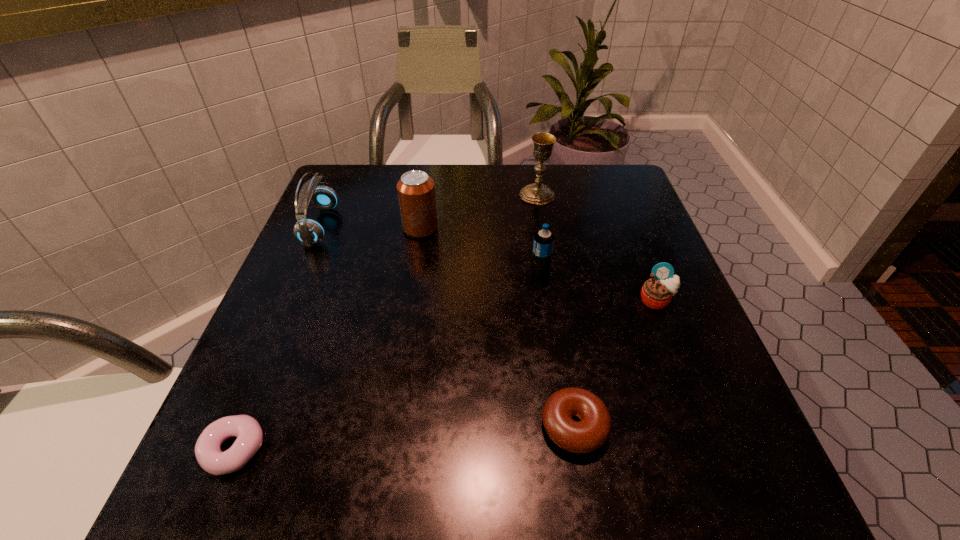
The image size is (960, 540). Find the location of `blank region between the left doughnut and the headset`. blank region between the left doughnut and the headset is located at coordinates (277, 338).

I want to click on vacant space that is in between the soda bottle and the can, so click(x=480, y=250).

Where is `free space between the rightmost object and the headset`? Image resolution: width=960 pixels, height=540 pixels. free space between the rightmost object and the headset is located at coordinates (489, 264).

Find the location of a particular element. Image resolution: width=960 pixels, height=540 pixels. vacant space in between the chalice and the shorter doughnut is located at coordinates (386, 322).

Locate an element on the screen. This screenshot has width=960, height=540. free space between the can and the chalice is located at coordinates (479, 212).

Where is `vacant region between the headset and the sixth tallest object`? The image size is (960, 540). vacant region between the headset and the sixth tallest object is located at coordinates (447, 326).

I want to click on vacant region between the headset and the shortest object, so click(277, 338).

Where is `object that is the fourth closest to the chalice`? The image size is (960, 540). object that is the fourth closest to the chalice is located at coordinates (308, 231).

Locate which object ranks fourth in proximity to the chalice. Please provide its 2D coordinates. Your answer should be formatted as a tuple, i.e. [(x, y)], where the tuple contains the x and y coordinates of a point satisfying the conditions above.

[(308, 231)]

This screenshot has height=540, width=960. Find the location of `vacant area that satisfies the following two spatial constraints: 1. on the back side of the fourth farthest object; 2. on the ear cups of the headset`. vacant area that satisfies the following two spatial constraints: 1. on the back side of the fourth farthest object; 2. on the ear cups of the headset is located at coordinates (534, 226).